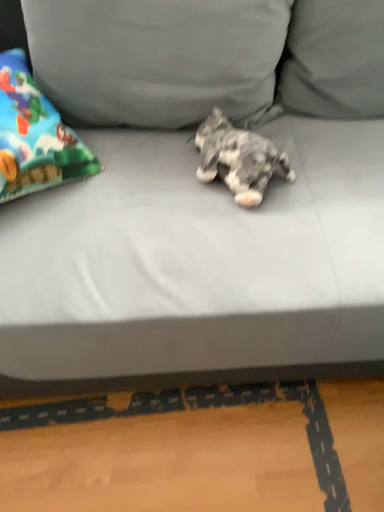
What are the coordinates of `free spot in front of fluffy gray dog at center` in the screenshot? It's located at (243, 233).